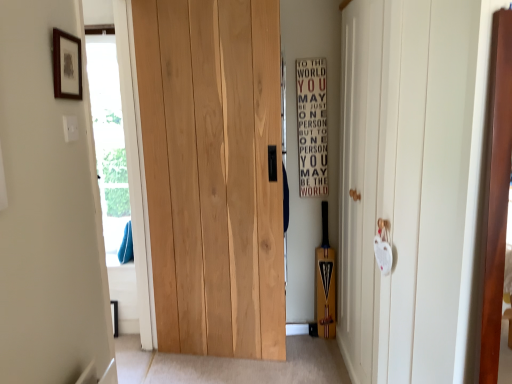
Question: Considering the relative positions of white matte door at right, the first door when ordered from right to left, and natural wood door at center, which is the first door in left-to-right order, in the image provided, is white matte door at right, the first door when ordered from right to left, to the right of natural wood door at center, which is the first door in left-to-right order, from the viewer's perspective?

Choices:
 (A) yes
 (B) no

Answer: (A)

Question: Can you confirm if white matte door at right, the first door when ordered from right to left, is taller than natural wood door at center, which is the first door in left-to-right order?

Choices:
 (A) no
 (B) yes

Answer: (A)

Question: Is white matte door at right, the first door when ordered from right to left, positioned with its back to natural wood door at center, which is the first door in left-to-right order?

Choices:
 (A) yes
 (B) no

Answer: (B)

Question: From the image's perspective, would you say white matte door at right, the first door when ordered from right to left, is positioned over natural wood door at center, the second door from the right?

Choices:
 (A) yes
 (B) no

Answer: (B)

Question: Is white matte door at right, the first door when ordered from right to left, surrounding natural wood door at center, the second door from the right?

Choices:
 (A) no
 (B) yes

Answer: (A)

Question: Can you confirm if white matte door at right, the first door when ordered from right to left, is wider than natural wood door at center, which is the first door in left-to-right order?

Choices:
 (A) yes
 (B) no

Answer: (A)

Question: Is natural wood door at center, the second door from the right, positioned behind transparent glass door at left?

Choices:
 (A) no
 (B) yes

Answer: (B)

Question: From a real-world perspective, is natural wood door at center, the second door from the right, over transparent glass door at left?

Choices:
 (A) no
 (B) yes

Answer: (A)

Question: Is natural wood door at center, the second door from the right, bigger than transparent glass door at left?

Choices:
 (A) no
 (B) yes

Answer: (A)

Question: Considering the relative sizes of natural wood door at center, the second door from the right, and transparent glass door at left in the image provided, is natural wood door at center, the second door from the right, smaller than transparent glass door at left?

Choices:
 (A) no
 (B) yes

Answer: (B)

Question: Is transparent glass door at left inside natural wood door at center, the second door from the right?

Choices:
 (A) no
 (B) yes

Answer: (A)

Question: Are natural wood door at center, the second door from the right, and transparent glass door at left located far from each other?

Choices:
 (A) no
 (B) yes

Answer: (A)

Question: Considering the relative sizes of white matte door at right, the first door when ordered from right to left, and wooden sign at center right in the image provided, is white matte door at right, the first door when ordered from right to left, taller than wooden sign at center right?

Choices:
 (A) no
 (B) yes

Answer: (B)